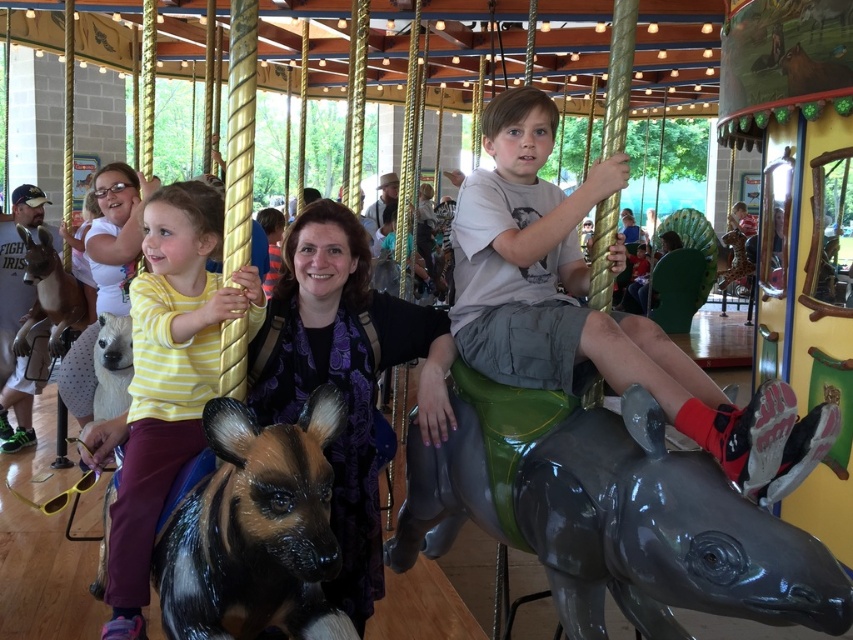
You are standing at the center of the carousel and want to take a photo of the shiny black horse at lower left using your camera. The camera is in your hand. Can you fit the entire horse into the photo without moving your position?

The shiny black horse at lower left and camera are 4.77 feet apart from each other. Since the distance between them is 4.77 feet, you can likely fit the entire horse into the photo without moving, as most cameras can capture objects at that distance without needing to adjust your position.

You are standing at the center of the carousel and looking towards the shiny black horse at lower left and the yellow striped shirt at left. Which object is positioned lower in the image?

The shiny black horse at lower left is positioned below the yellow striped shirt at left, so the shiny black horse at lower left is lower in the image.

You are a photographer standing at the front of the carousel. You want to take a photo that includes both the matte gray shorts at center and the yellow striped shirt at left. Which object should you focus on first to ensure both are in clear view?

You should focus on the matte gray shorts at center first because it is closer to the viewer than the yellow striped shirt at left, so adjusting focus from near to far will help both be in clear view.